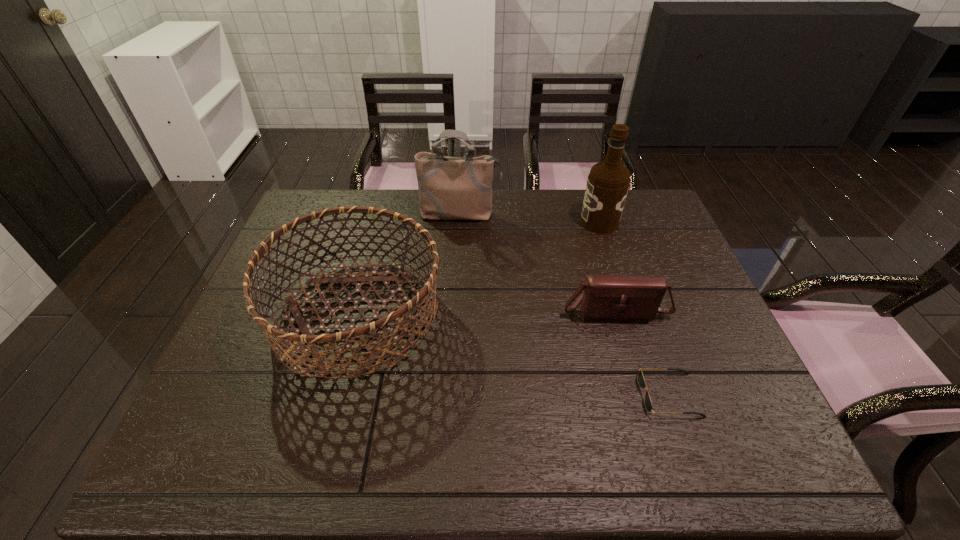
Identify the location of free space located on the front-facing side of the left shoulder bag. (458, 253).

In order to click on free space located 0.330m on the back of the third shortest object in this screenshot , I will do `click(390, 197)`.

Where is `vacant space positioned on the front flap of the fourth tallest object`? The height and width of the screenshot is (540, 960). vacant space positioned on the front flap of the fourth tallest object is located at coordinates (647, 421).

At what (x,y) coordinates should I click in order to perform the action: click on vacant space positioned 0.150m on the front-facing side of the sunglasses. Please return your answer as a coordinate pair (x, y). Looking at the image, I should click on (574, 395).

At what (x,y) coordinates should I click in order to perform the action: click on free location located on the front-facing side of the sunglasses. Please return your answer as a coordinate pair (x, y). The height and width of the screenshot is (540, 960). Looking at the image, I should click on (512, 395).

Locate an element on the screen. Image resolution: width=960 pixels, height=540 pixels. free space located on the front-facing side of the sunglasses is located at coordinates pos(583,395).

Locate an element on the screen. alcohol at the far edge is located at coordinates (608, 182).

Find the location of a particular element. The width and height of the screenshot is (960, 540). shoulder bag present at the far edge is located at coordinates (450, 188).

Find the location of a particular element. The width and height of the screenshot is (960, 540). object that is positioned at the left edge is located at coordinates (383, 344).

Locate an element on the screen. The height and width of the screenshot is (540, 960). alcohol located in the right edge section of the desktop is located at coordinates (608, 182).